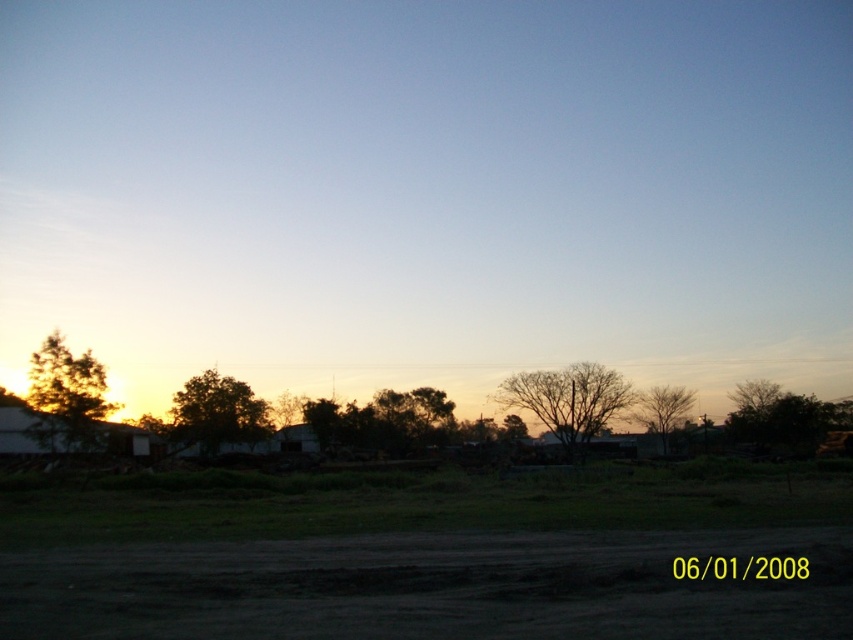
Question: Which point is closer to the camera?

Choices:
 (A) bare branches at center
 (B) brown leafless tree at center-right

Answer: (A)

Question: Which object appears closest to the camera in this image?

Choices:
 (A) green leafy tree at center
 (B) bare branches at center
 (C) green leafy tree at left

Answer: (C)

Question: Which point is closer to the camera taking this photo?

Choices:
 (A) (654, 410)
 (B) (566, 429)
 (C) (45, 442)

Answer: (C)

Question: Can you confirm if green leafy tree at center is bigger than brown leafless tree at center-right?

Choices:
 (A) no
 (B) yes

Answer: (A)

Question: Where is green leafy tree at right located in relation to brown leafless tree at center-right in the image?

Choices:
 (A) left
 (B) right

Answer: (B)

Question: Can you confirm if green leafy tree at right is bigger than brown leafless tree at center-right?

Choices:
 (A) no
 (B) yes

Answer: (B)